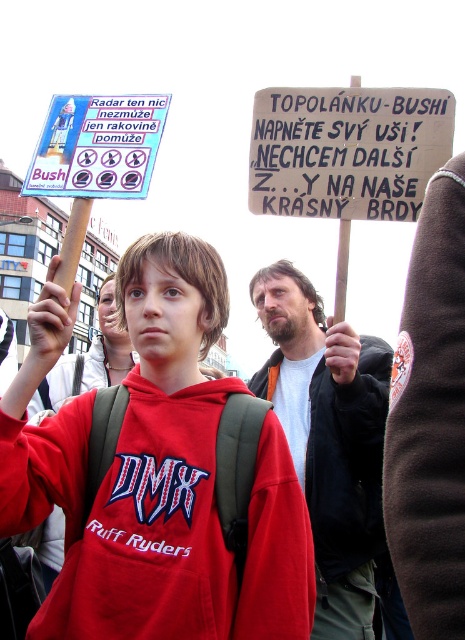
Question: Based on their relative distances, which object is farther from the wooden signboard at upper right?

Choices:
 (A) red cotton sweatshirt at center
 (B) matte black jacket at center
 (C) matte plastic sign at upper left
 (D) beige fabric jacket at center

Answer: (B)

Question: Which point appears farthest from the camera in this image?

Choices:
 (A) (283, 333)
 (B) (53, 554)
 (C) (431, 170)

Answer: (A)

Question: Considering the relative positions of wooden signboard at upper right and matte black jacket at center in the image provided, where is wooden signboard at upper right located with respect to matte black jacket at center?

Choices:
 (A) below
 (B) above

Answer: (B)

Question: Can you confirm if red cotton sweatshirt at center is smaller than wooden signboard at upper right?

Choices:
 (A) no
 (B) yes

Answer: (A)

Question: Can you confirm if red cotton sweatshirt at center is positioned to the left of wooden signboard at upper right?

Choices:
 (A) yes
 (B) no

Answer: (A)

Question: Among these objects, which one is farthest from the camera?

Choices:
 (A) red cotton sweatshirt at center
 (B) beige fabric jacket at center

Answer: (B)